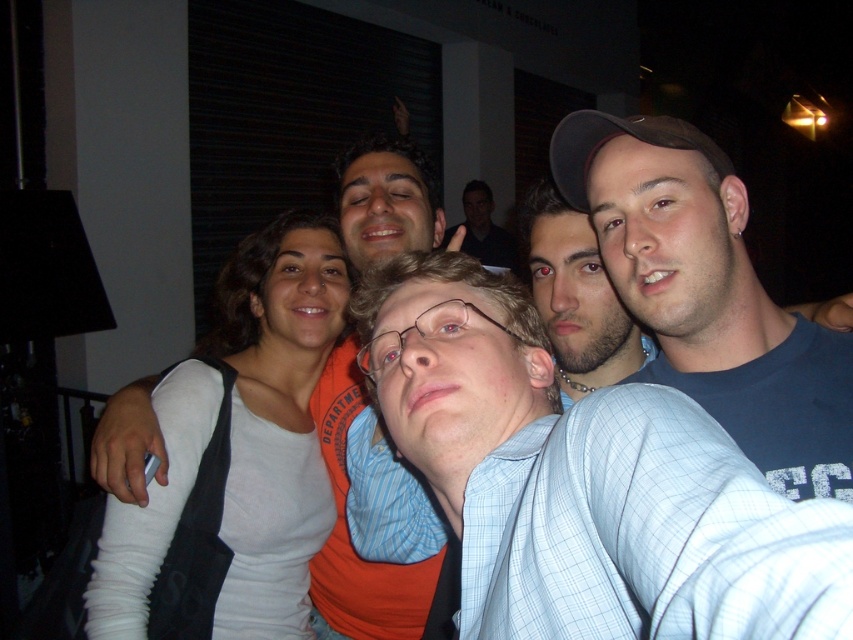
Can you confirm if light blue plaid shirt at center is taller than white matte shirt at center?

No, light blue plaid shirt at center is not taller than white matte shirt at center.

Does light blue plaid shirt at center have a smaller size compared to white matte shirt at center?

Yes.

Who is more distant from viewer, (x=575, y=616) or (x=314, y=566)?

Point (x=314, y=566)

The height and width of the screenshot is (640, 853). I want to click on light blue plaid shirt at center, so click(x=544, y=461).

Can you confirm if light blue plaid shirt at center is taller than blue t-shirt at center?

No.

Which of these two, light blue plaid shirt at center or blue t-shirt at center, stands shorter?

With less height is light blue plaid shirt at center.

Where is `light blue plaid shirt at center`? light blue plaid shirt at center is located at coordinates (544, 461).

Between white matte shirt at center and smooth black shirt at center, which one is positioned higher?

smooth black shirt at center is above.

Can you confirm if white matte shirt at center is shorter than smooth black shirt at center?

No.

You are a GUI agent. You are given a task and a screenshot of the screen. Output one action in this format:
    pyautogui.click(x=<x>, y=<y>)
    Task: Click on the white matte shirt at center
    The height and width of the screenshot is (640, 853).
    Given the screenshot: What is the action you would take?
    pyautogui.click(x=347, y=531)